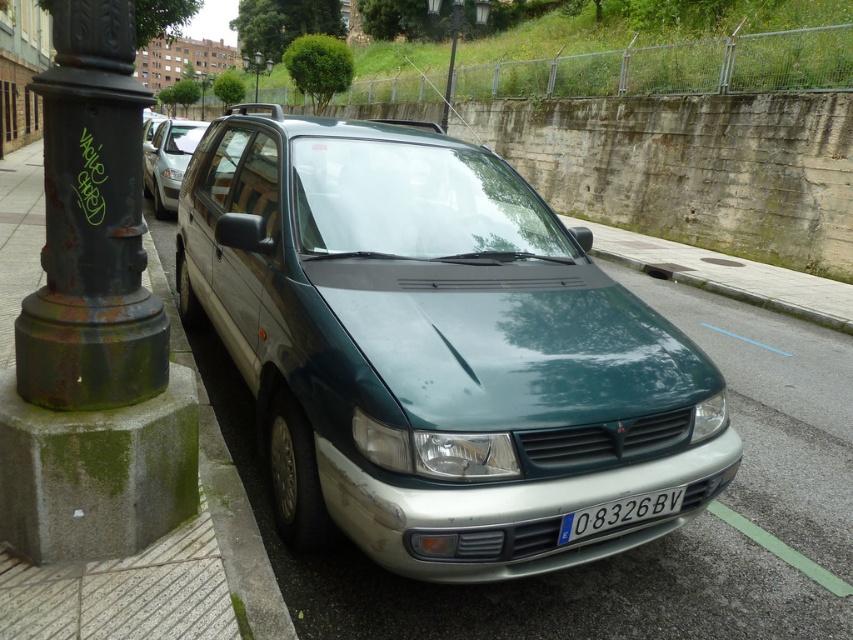
You are a delivery person needing to park your van in a spot that requires clearance under a low bridge. The bridge has a height restriction sign stating that vehicles taller than 2.5 meters are prohibited. Given the green matte van at center and the rusty metal pole at left, which object would you compare the van height to determine if it meets the height requirement?

The green matte van at center is not as tall as the rusty metal pole at left. Since the van is shorter than the pole, and assuming the pole is within the height limit, the van likely meets the 2.5 meters requirement.

You are standing on the sidewalk next to the parked car and want to take a photo of the green matte van at center. Where should you position yourself to capture the van in the frame?

The green matte van at center is located at coordinates point (434, 349), so you should position yourself directly in front of it to ensure it is centered in your photo.

You are a delivery driver who needs to park your vehicle on the sidewalk. The parking space must be at least 1.5 meters wide. The green mossy concrete at left is part of the sidewalk. Can you safely park your vehicle here?

The green mossy concrete at left is part of the sidewalk, but there is no information provided about the width of the sidewalk or parking space. Therefore, it is unclear if the parking space meets the 1.5 meters width requirement.